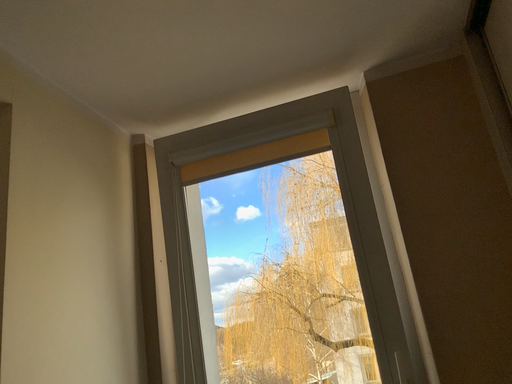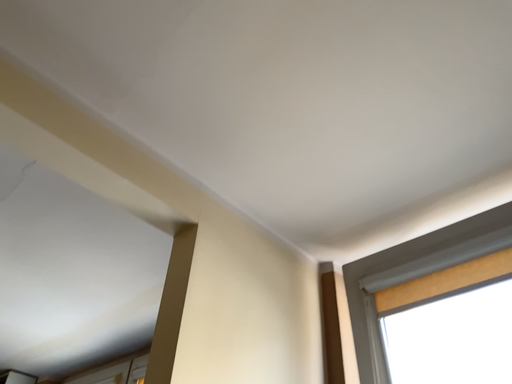
Question: Which way did the camera rotate in the video?

Choices:
 (A) rotated downward
 (B) rotated upward

Answer: (B)